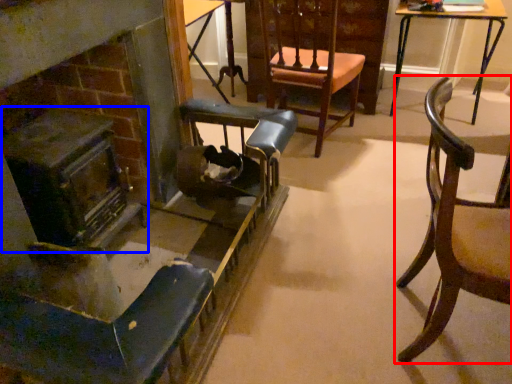
Question: Which of the following is the farthest to the observer, chair (highlighted by a red box) or fireplace (highlighted by a blue box)?

Choices:
 (A) chair
 (B) fireplace

Answer: (B)